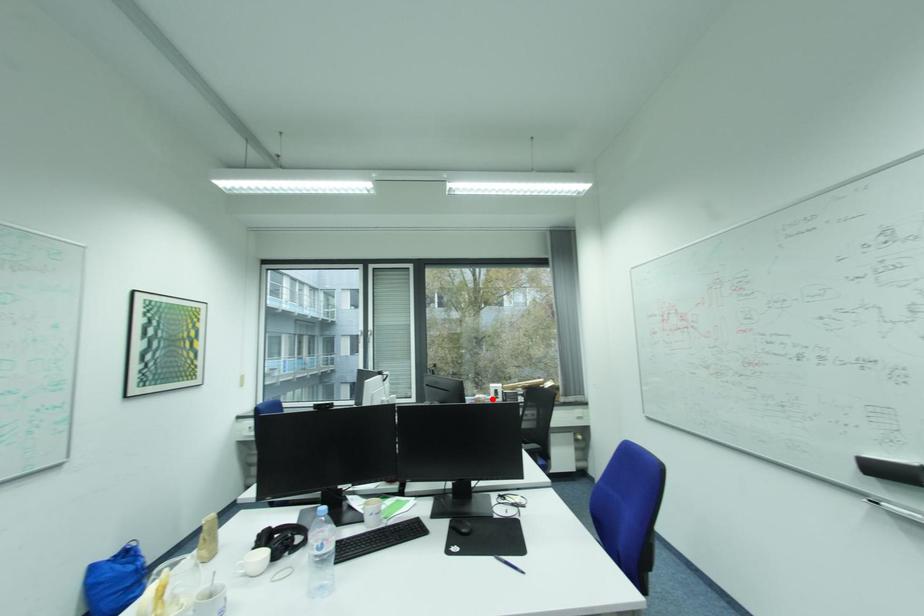
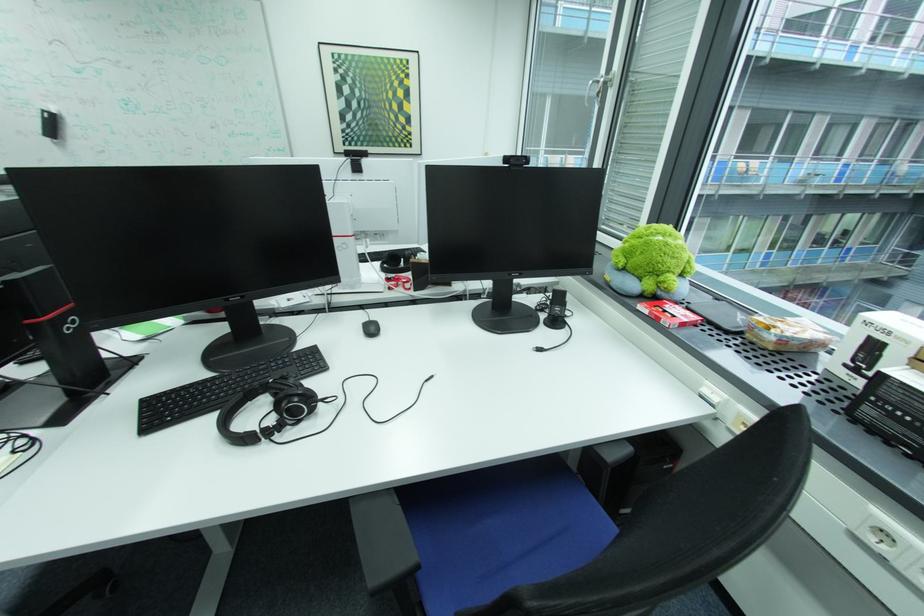
Question: I am providing you with two images of the same scene from different viewpoints. Given a red point in image1, look at the same physical point in image2. Is it:

Choices:
 (A) Closer to the viewpoint
 (B) Farther from the viewpoint

Answer: (A)